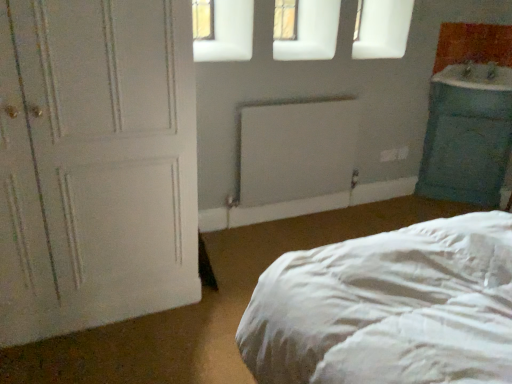
Question: From the image's perspective, is white matte door at left located beneath white matte radiator at center?

Choices:
 (A) no
 (B) yes

Answer: (B)

Question: Is white matte door at left smaller than white matte radiator at center?

Choices:
 (A) yes
 (B) no

Answer: (B)

Question: Can you confirm if white matte door at left is thinner than white matte radiator at center?

Choices:
 (A) yes
 (B) no

Answer: (B)

Question: Are white matte door at left and white matte radiator at center far apart?

Choices:
 (A) yes
 (B) no

Answer: (A)

Question: From a real-world perspective, is white matte door at left located beneath white matte radiator at center?

Choices:
 (A) no
 (B) yes

Answer: (A)

Question: Considering their positions, is blue glossy sink at right located in front of or behind white matte door at left?

Choices:
 (A) front
 (B) behind

Answer: (B)

Question: Considering the positions of blue glossy sink at right and white matte door at left in the image, is blue glossy sink at right wider or thinner than white matte door at left?

Choices:
 (A) wide
 (B) thin

Answer: (B)

Question: Would you say blue glossy sink at right is to the left or to the right of white matte door at left in the picture?

Choices:
 (A) right
 (B) left

Answer: (A)

Question: In terms of size, does blue glossy sink at right appear bigger or smaller than white matte door at left?

Choices:
 (A) small
 (B) big

Answer: (A)

Question: In the image, is white matte radiator at center on the left side or the right side of white matte door at left?

Choices:
 (A) right
 (B) left

Answer: (A)

Question: From the image's perspective, is white matte radiator at center located above or below white matte door at left?

Choices:
 (A) below
 (B) above

Answer: (B)

Question: From a real-world perspective, is white matte radiator at center positioned above or below white matte door at left?

Choices:
 (A) above
 (B) below

Answer: (B)

Question: Considering the positions of white matte radiator at center and white matte door at left in the image, is white matte radiator at center bigger or smaller than white matte door at left?

Choices:
 (A) small
 (B) big

Answer: (A)

Question: From the image's perspective, is white matte door at left positioned above or below white matte radiator at center?

Choices:
 (A) below
 (B) above

Answer: (A)

Question: Considering the positions of point (147, 296) and point (328, 178), is point (147, 296) closer or farther from the camera than point (328, 178)?

Choices:
 (A) farther
 (B) closer

Answer: (B)